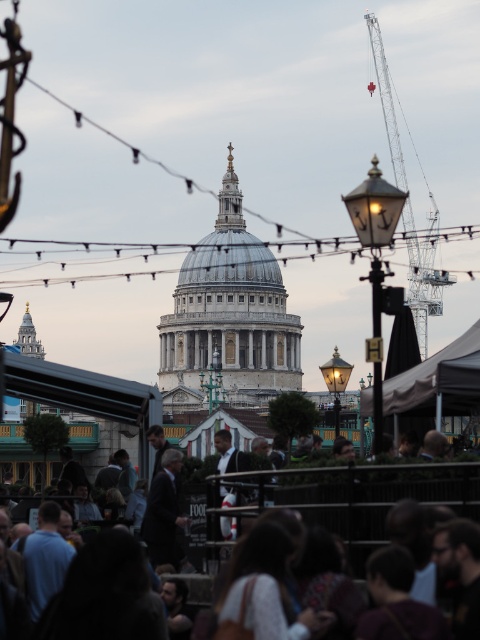
Question: Does dark brown hair at lower center appear on the right side of dark suit at center?

Choices:
 (A) yes
 (B) no

Answer: (A)

Question: Which object is positioned closest to the metallic gray crane at upper right?

Choices:
 (A) dark suit at center
 (B) dark brown hair at lower center

Answer: (A)

Question: Is dark brown hair at lower center to the right of metallic gray crane at upper right from the viewer's perspective?

Choices:
 (A) no
 (B) yes

Answer: (A)

Question: Is dark brown hair at lower center bigger than dark suit at center?

Choices:
 (A) yes
 (B) no

Answer: (A)

Question: Which is farther from the dark suit at center?

Choices:
 (A) dark brown hair at lower center
 (B) metallic gray crane at upper right

Answer: (B)

Question: Among these objects, which one is farthest from the camera?

Choices:
 (A) dark suit at center
 (B) metallic gray crane at upper right
 (C) dark brown hair at lower center

Answer: (B)